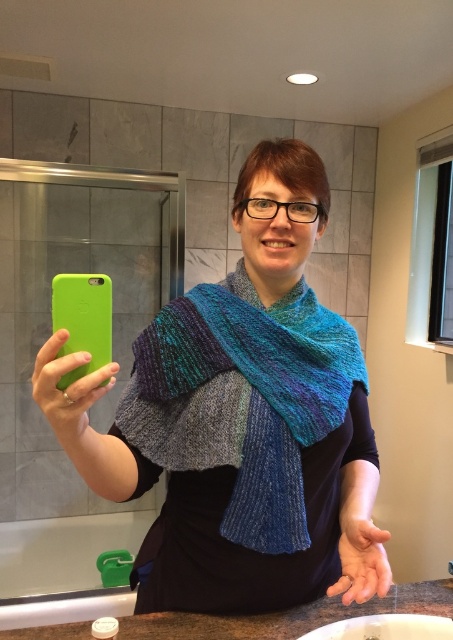
Is point (68, 328) closer to viewer compared to point (38, 368)?

No, (68, 328) is behind (38, 368).

The image size is (453, 640). Find the location of `green matte phone at left`. green matte phone at left is located at coordinates (82, 320).

Which is above, granite countertop at lower center or green matte phone at left?

green matte phone at left

Describe the element at coordinates (289, 616) in the screenshot. I see `granite countertop at lower center` at that location.

Between point (245, 632) and point (110, 314), which one is positioned behind?

Point (245, 632)

In order to click on granite countertop at lower center in this screenshot , I will do `click(289, 616)`.

Is granite countertop at lower center bigger than knitted fabric hand at center?

Indeed, granite countertop at lower center has a larger size compared to knitted fabric hand at center.

Looking at this image, between granite countertop at lower center and knitted fabric hand at center, which one has more height?

knitted fabric hand at center

Identify the location of granite countertop at lower center. (289, 616).